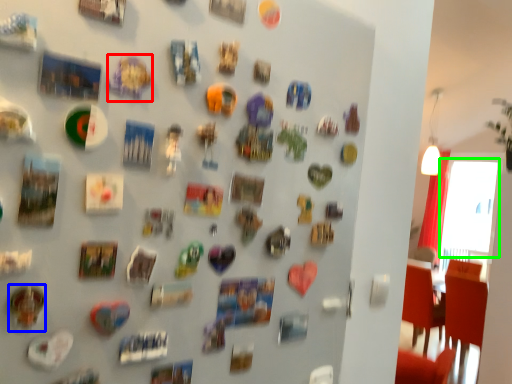
Question: Which object is the closest to the art (highlighted by a red box)? Choose among these: art (highlighted by a blue box) or window screen (highlighted by a green box).

Choices:
 (A) art
 (B) window screen

Answer: (A)